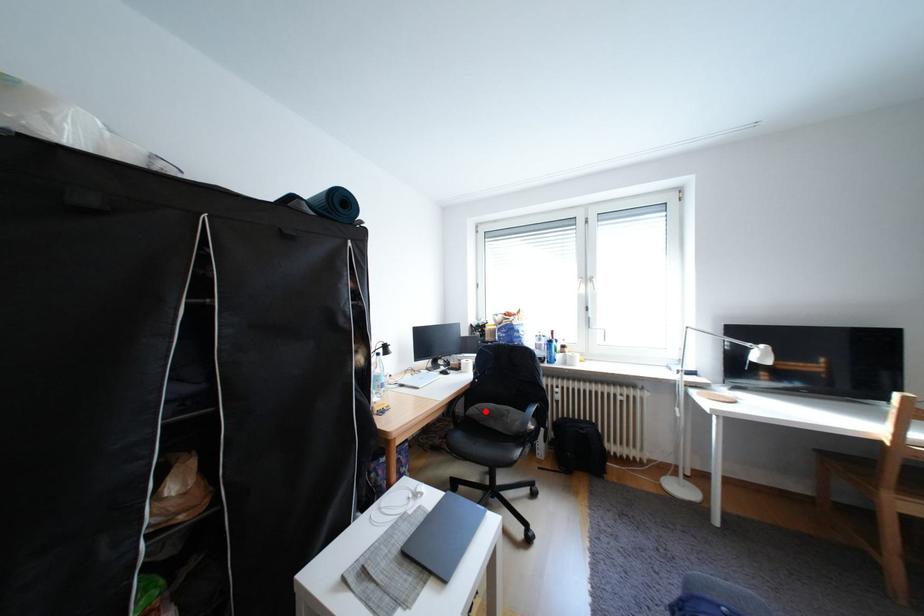
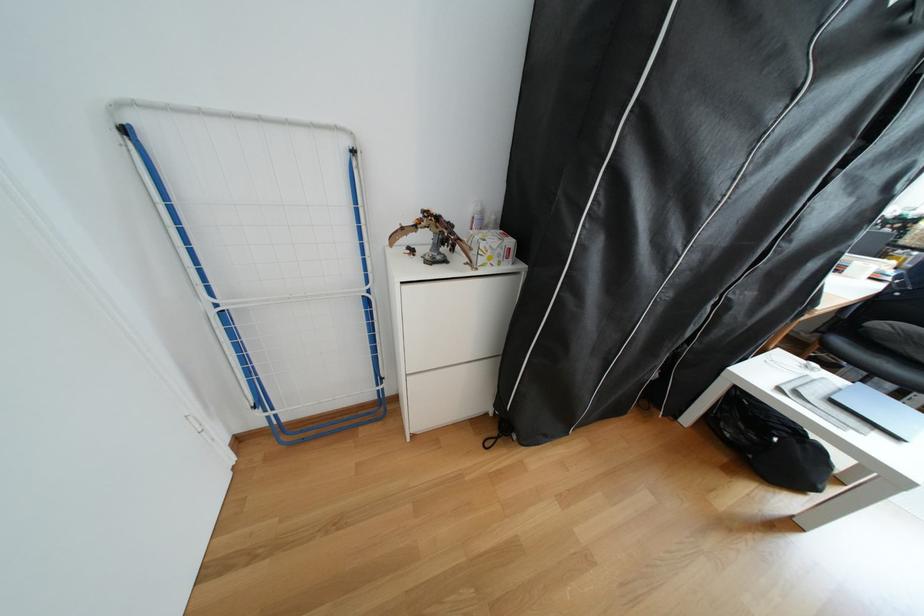
Where in the second image is the point corresponding to the highlighted location from the first image?

(894, 326)